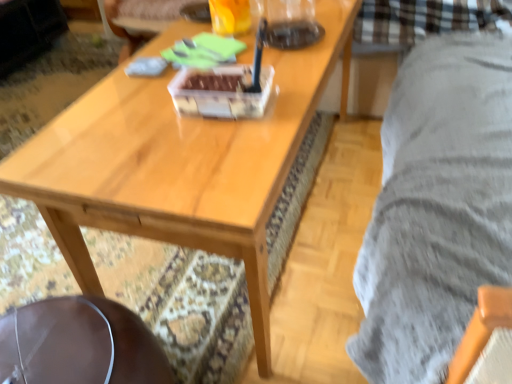
Question: From a real-world perspective, is translucent glass beverage at upper center under brown leather swivel chair at lower left?

Choices:
 (A) no
 (B) yes

Answer: (A)

Question: Could you tell me if translucent glass beverage at upper center is facing brown leather swivel chair at lower left?

Choices:
 (A) no
 (B) yes

Answer: (A)

Question: Can you confirm if translucent glass beverage at upper center is bigger than brown leather swivel chair at lower left?

Choices:
 (A) no
 (B) yes

Answer: (A)

Question: Does translucent glass beverage at upper center have a lesser width compared to brown leather swivel chair at lower left?

Choices:
 (A) yes
 (B) no

Answer: (A)

Question: Is translucent glass beverage at upper center behind brown leather swivel chair at lower left?

Choices:
 (A) yes
 (B) no

Answer: (A)

Question: From a real-world perspective, is brown leather swivel chair at lower left physically located above or below translucent glass beverage at upper center?

Choices:
 (A) below
 (B) above

Answer: (A)

Question: From the image's perspective, is brown leather swivel chair at lower left positioned above or below translucent glass beverage at upper center?

Choices:
 (A) above
 (B) below

Answer: (B)

Question: Considering the positions of point (30, 380) and point (219, 26), is point (30, 380) closer or farther from the camera than point (219, 26)?

Choices:
 (A) farther
 (B) closer

Answer: (B)

Question: From their relative heights in the image, would you say brown leather swivel chair at lower left is taller or shorter than translucent glass beverage at upper center?

Choices:
 (A) short
 (B) tall

Answer: (B)

Question: Considering their positions, is translucent glass beverage at upper center located in front of or behind brown leather swivel chair at lower left?

Choices:
 (A) behind
 (B) front

Answer: (A)

Question: Would you say translucent glass beverage at upper center is inside or outside brown leather swivel chair at lower left?

Choices:
 (A) inside
 (B) outside

Answer: (B)

Question: Would you say translucent glass beverage at upper center is to the left or to the right of brown leather swivel chair at lower left in the picture?

Choices:
 (A) left
 (B) right

Answer: (B)

Question: From a real-world perspective, is translucent glass beverage at upper center positioned above or below brown leather swivel chair at lower left?

Choices:
 (A) above
 (B) below

Answer: (A)

Question: Is translucent glass beverage at upper center situated inside wooden coffee table at center or outside?

Choices:
 (A) outside
 (B) inside

Answer: (A)

Question: Considering the positions of translucent glass beverage at upper center and wooden coffee table at center in the image, is translucent glass beverage at upper center wider or thinner than wooden coffee table at center?

Choices:
 (A) thin
 (B) wide

Answer: (A)